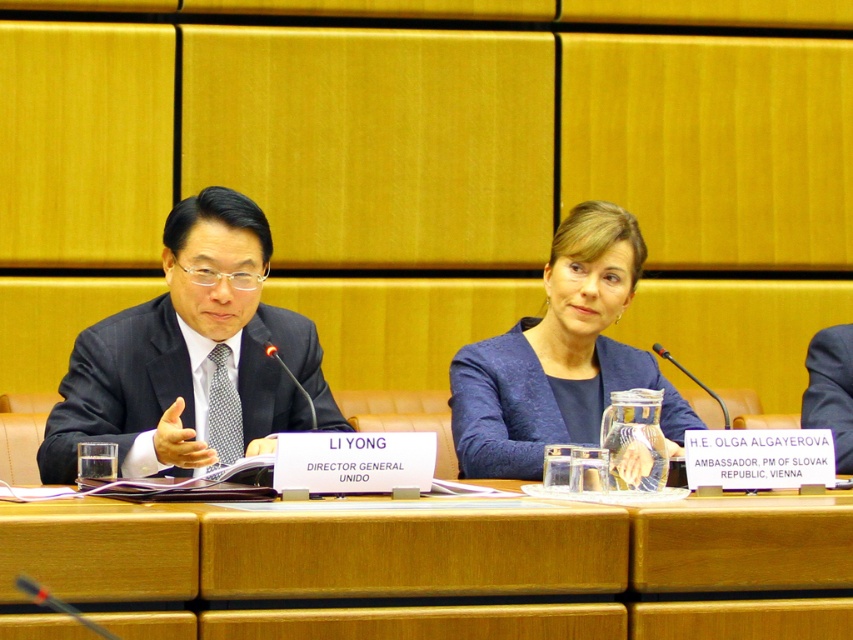
Question: Among these points, which one is farthest from the camera?

Choices:
 (A) (247, 424)
 (B) (190, 540)
 (C) (804, 416)
 (D) (567, 330)

Answer: (C)

Question: Is matte black suit at left bigger than blue fabric business suit at center?

Choices:
 (A) no
 (B) yes

Answer: (B)

Question: Is wooden at center in front of matte black suit at left?

Choices:
 (A) no
 (B) yes

Answer: (B)

Question: Which of the following is the closest to the observer?

Choices:
 (A) (299, 547)
 (B) (126, 339)
 (C) (602, 365)

Answer: (A)

Question: Does wooden at center appear over blue fabric business suit at center?

Choices:
 (A) yes
 (B) no

Answer: (B)

Question: Which point is farther to the camera?

Choices:
 (A) (263, 365)
 (B) (463, 387)
 (C) (827, 404)
 (D) (543, 589)

Answer: (C)